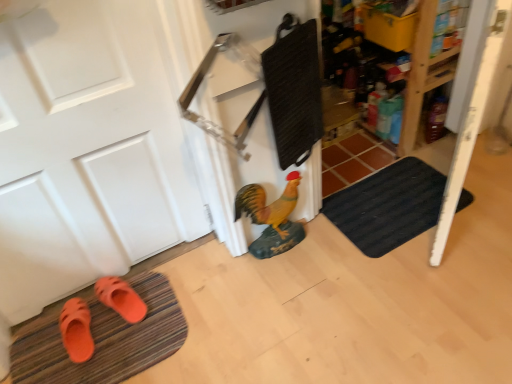
Find the location of a particular element. The height and width of the screenshot is (384, 512). vacant area that lies between shiny yellow chicken at center and black textured bath mat at lower right, the second bath mat positioned from the left is located at coordinates (318, 250).